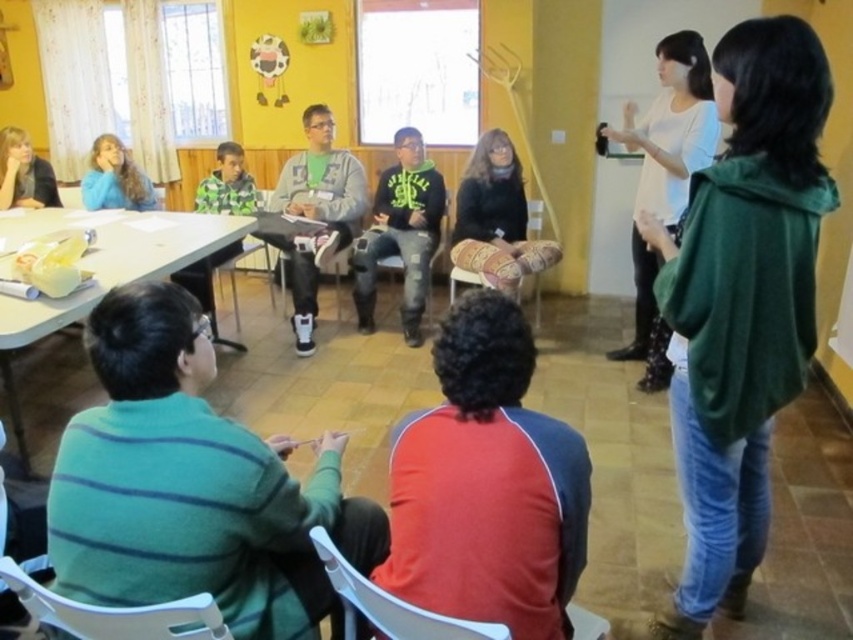
Question: Which object is positioned closest to the blue fleece jacket at upper left?

Choices:
 (A) white plastic table at lower left
 (B) green matte hoodie at center
 (C) white plastic chair at lower left
 (D) black sweater at center

Answer: (A)

Question: From the image, what is the correct spatial relationship of white plastic table at lower left in relation to gray fleece jacket at center?

Choices:
 (A) above
 (B) below

Answer: (B)

Question: Among these points, which one is nearest to the camera?

Choices:
 (A) (527, 499)
 (B) (543, 259)

Answer: (A)

Question: Where is gray fleece jacket at center located in relation to white plastic chair at center in the image?

Choices:
 (A) above
 (B) below

Answer: (A)

Question: Is white matte shirt at upper right smaller than green patterned sweater at center?

Choices:
 (A) no
 (B) yes

Answer: (A)

Question: Which object is the farthest from the green cotton hoodie at upper right?

Choices:
 (A) green striped sweater at lower left
 (B) white plastic table at lower left
 (C) white plastic chair at lower left
 (D) black sweater at center

Answer: (B)